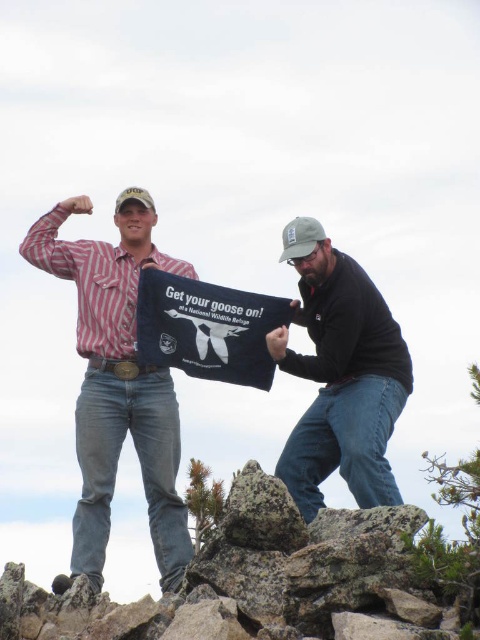
Question: Does matte red plaid shirt at center have a greater width compared to dark blue fabric sign at center?

Choices:
 (A) no
 (B) yes

Answer: (B)

Question: Which object is farther from the camera taking this photo?

Choices:
 (A) dark blue fabric sign at center
 (B) rough granite rocks at center
 (C) matte red plaid shirt at center
 (D) black fabric sign at center

Answer: (D)

Question: Can you confirm if dark blue fabric sign at center is smaller than black fabric sign at center?

Choices:
 (A) yes
 (B) no

Answer: (B)

Question: Does rough granite rocks at center appear on the left side of matte red plaid shirt at center?

Choices:
 (A) yes
 (B) no

Answer: (B)

Question: Among these objects, which one is nearest to the camera?

Choices:
 (A) matte red plaid shirt at center
 (B) dark blue fabric sign at center
 (C) rough granite rocks at center

Answer: (C)

Question: Which point is closer to the camera taking this photo?

Choices:
 (A) (72, 275)
 (B) (181, 346)
 (C) (122, 616)

Answer: (C)